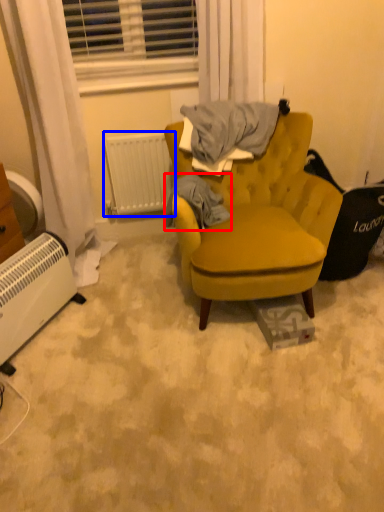
Question: Which object appears farthest to the camera in this image, clothing (highlighted by a red box) or radiator (highlighted by a blue box)?

Choices:
 (A) clothing
 (B) radiator

Answer: (B)